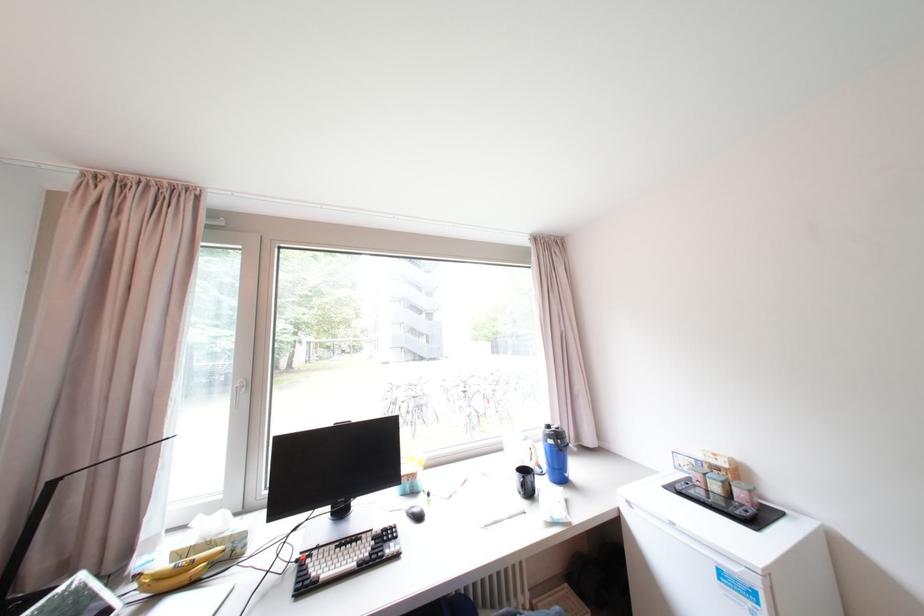
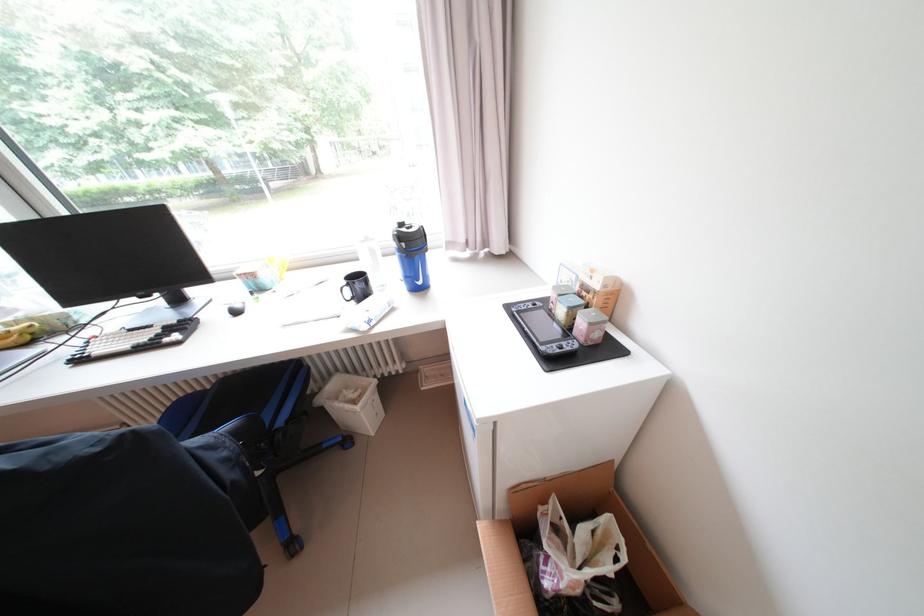
Question: I am providing you with two images of the same scene from different viewpoints. After the viewpoint changes to image2, which objects are now occluded?

Choices:
 (A) light blue tin
 (B) white trash can
 (C) pink tin
 (D) none of these

Answer: (D)